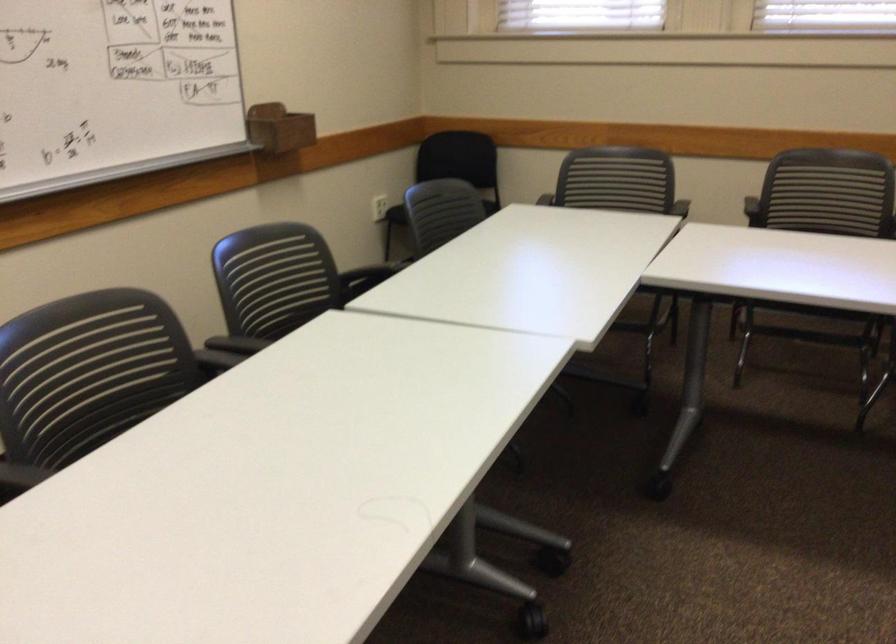
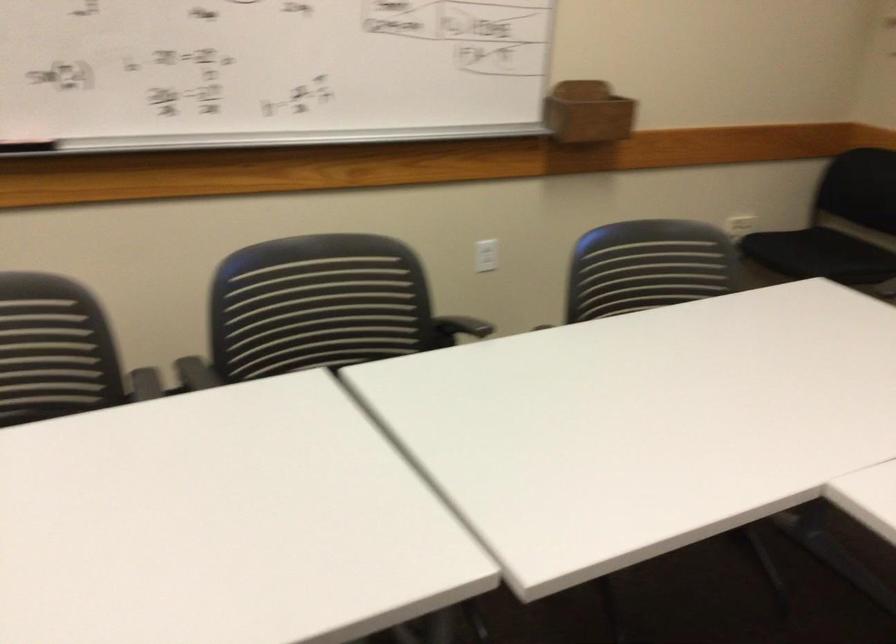
Where in the second image is the point corresponding to (x=235, y=297) from the first image?

(317, 308)